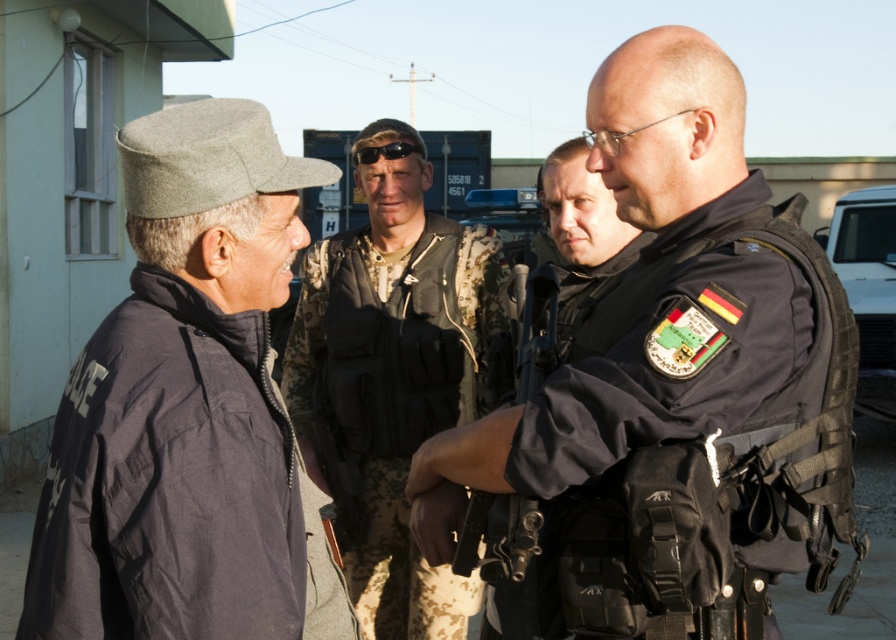
You are a photographer trying to capture a closeup shot of both the black tactical vest at center and the dark gray woolen hat at left. Since you want to ensure both are in focus, you need to know which object is larger. Which one is bigger?

The black tactical vest at center is bigger than the dark gray woolen hat at left, so you should focus on the black tactical vest at center as it requires more attention due to its larger size.

Based on the scene description, where is the dark gray woolen hat at left located in the image?

The dark gray woolen hat at left is located at the 2D coordinates point (x=182, y=403) in the image.

You are a photographer trying to capture a clear photo of the dark gray woolen hat at left and the black tactical vest at center. Since you can only focus on one subject at a time, which one should you focus on to ensure it appears sharp in the background?

The dark gray woolen hat at left is behind the black tactical vest at center, so focusing on the black tactical vest at center will keep it sharp while the hat may appear slightly blurred in the background.